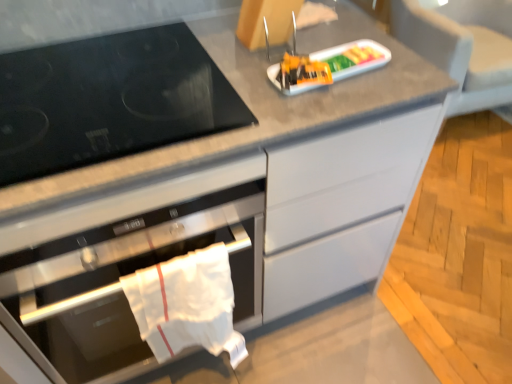
Question: Is plastic tray at center located within white cloth towel at lower left?

Choices:
 (A) yes
 (B) no

Answer: (B)

Question: Is white cloth towel at lower left completely or partially outside of plastic tray at center?

Choices:
 (A) no
 (B) yes

Answer: (B)

Question: From the image's perspective, would you say white cloth towel at lower left is shown under plastic tray at center?

Choices:
 (A) no
 (B) yes

Answer: (B)

Question: Can you confirm if white cloth towel at lower left is bigger than plastic tray at center?

Choices:
 (A) no
 (B) yes

Answer: (B)

Question: Does white cloth towel at lower left lie behind plastic tray at center?

Choices:
 (A) no
 (B) yes

Answer: (A)

Question: Is point (94, 251) closer or farther from the camera than point (23, 87)?

Choices:
 (A) closer
 (B) farther

Answer: (A)

Question: Based on their sizes in the image, would you say stainless steel oven at center is bigger or smaller than black glass gas stove at left?

Choices:
 (A) big
 (B) small

Answer: (A)

Question: From a real-world perspective, relative to black glass gas stove at left, is stainless steel oven at center vertically above or below?

Choices:
 (A) below
 (B) above

Answer: (A)

Question: Is stainless steel oven at center in front of or behind black glass gas stove at left in the image?

Choices:
 (A) front
 (B) behind

Answer: (A)

Question: Is stainless steel oven at center taller or shorter than white cloth towel at lower left?

Choices:
 (A) short
 (B) tall

Answer: (B)

Question: Is stainless steel oven at center situated inside white cloth towel at lower left or outside?

Choices:
 (A) inside
 (B) outside

Answer: (B)

Question: Based on their positions, is stainless steel oven at center located to the left or right of white cloth towel at lower left?

Choices:
 (A) right
 (B) left

Answer: (B)

Question: Looking at their shapes, would you say stainless steel oven at center is wider or thinner than white cloth towel at lower left?

Choices:
 (A) wide
 (B) thin

Answer: (A)

Question: From their relative heights in the image, would you say gray fabric armchair at upper right is taller or shorter than stainless steel oven at center?

Choices:
 (A) tall
 (B) short

Answer: (B)

Question: Does point (499, 74) appear closer or farther from the camera than point (108, 329)?

Choices:
 (A) farther
 (B) closer

Answer: (A)